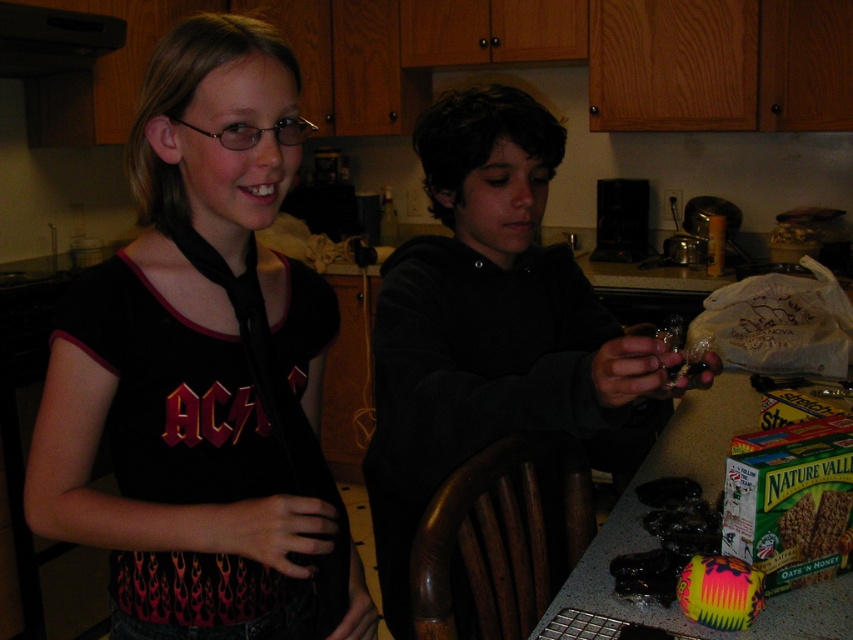
What is the object located at the coordinates point [202,368]?

The object located at point [202,368] is the black matte tie at center.